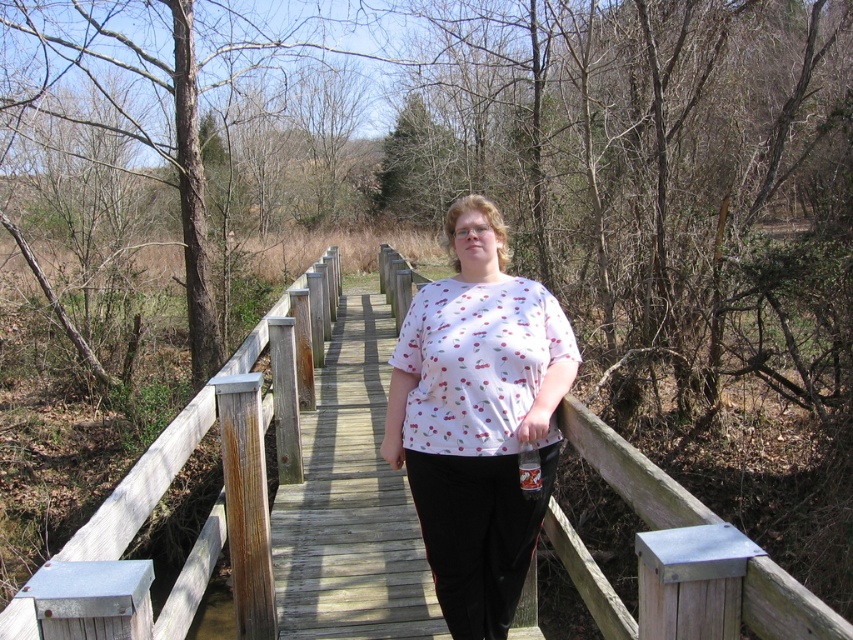
Which of these two, wooden bridge at center or wooden fence at center, stands taller?

With more height is wooden bridge at center.

Is point (292, 516) positioned behind point (670, 486)?

Yes, point (292, 516) is behind point (670, 486).

Identify the location of wooden bridge at center. Image resolution: width=853 pixels, height=640 pixels. (351, 504).

Describe the element at coordinates (477, 419) in the screenshot. I see `white printed shirt at center` at that location.

Where is `white printed shirt at center`? white printed shirt at center is located at coordinates (477, 419).

Which of these two, white printed shirt at center or wooden bridge at center, stands taller?

white printed shirt at center is taller.

In the scene shown: Between white printed shirt at center and wooden bridge at center, which one has less height?

wooden bridge at center

Is point (506, 310) positioned after point (314, 550)?

That is False.

At what (x,y) coordinates should I click in order to perform the action: click on white printed shirt at center. Please return your answer as a coordinate pair (x, y). Looking at the image, I should click on (477, 419).